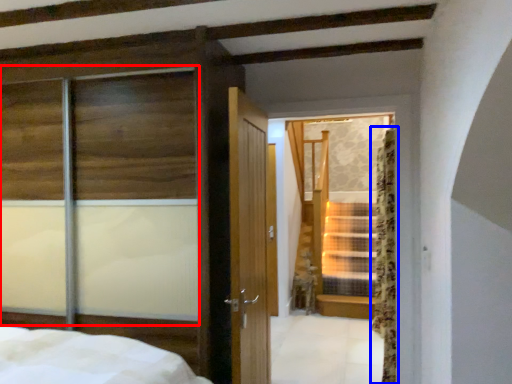
Question: Which object is further to the camera taking this photo, window (highlighted by a red box) or curtain (highlighted by a blue box)?

Choices:
 (A) window
 (B) curtain

Answer: (B)